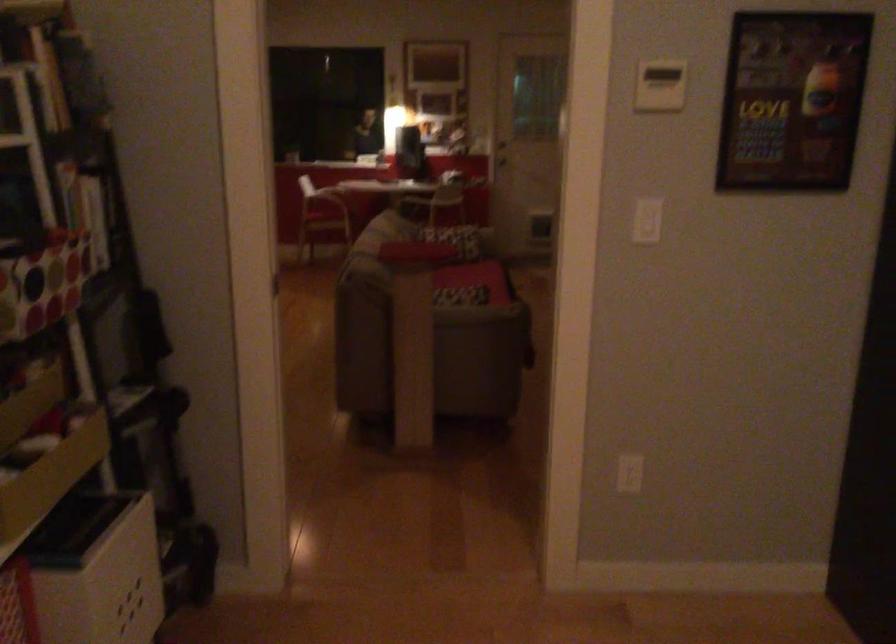
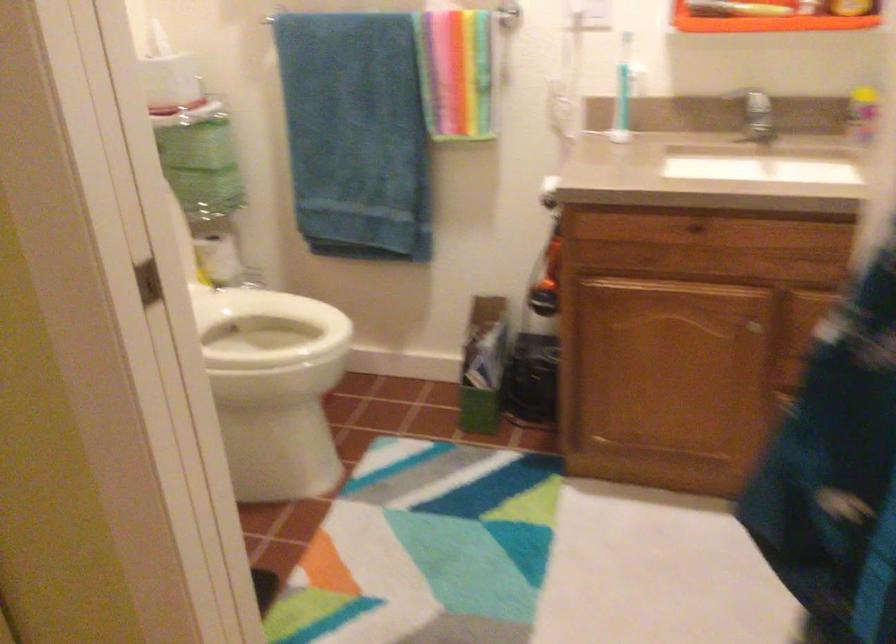
The first image is from the beginning of the video and the second image is from the end. How did the camera likely rotate when shooting the video?

The rotation direction of the camera is left-down.